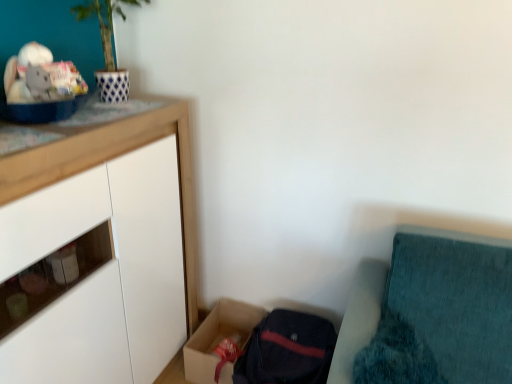
Question: Are white matte cabinet at upper left and cardboard box at lower center located far from each other?

Choices:
 (A) yes
 (B) no

Answer: (B)

Question: Does white matte cabinet at upper left have a larger size compared to cardboard box at lower center?

Choices:
 (A) yes
 (B) no

Answer: (A)

Question: Does white matte cabinet at upper left have a lesser height compared to cardboard box at lower center?

Choices:
 (A) no
 (B) yes

Answer: (A)

Question: Is cardboard box at lower center completely or partially inside white matte cabinet at upper left?

Choices:
 (A) yes
 (B) no

Answer: (B)

Question: Is white matte cabinet at upper left to the left of cardboard box at lower center from the viewer's perspective?

Choices:
 (A) yes
 (B) no

Answer: (A)

Question: Are white matte cabinet at upper left and cardboard box at lower center making contact?

Choices:
 (A) yes
 (B) no

Answer: (B)

Question: Is cardboard box at lower center located within teal fabric cushion at lower right?

Choices:
 (A) yes
 (B) no

Answer: (B)

Question: Is teal fabric cushion at lower right with cardboard box at lower center?

Choices:
 (A) yes
 (B) no

Answer: (B)

Question: From a real-world perspective, is teal fabric cushion at lower right beneath cardboard box at lower center?

Choices:
 (A) no
 (B) yes

Answer: (A)

Question: From the image's perspective, is teal fabric cushion at lower right on top of cardboard box at lower center?

Choices:
 (A) yes
 (B) no

Answer: (A)

Question: Considering the relative sizes of teal fabric cushion at lower right and cardboard box at lower center in the image provided, is teal fabric cushion at lower right wider than cardboard box at lower center?

Choices:
 (A) no
 (B) yes

Answer: (A)

Question: Is teal fabric cushion at lower right facing towards cardboard box at lower center?

Choices:
 (A) no
 (B) yes

Answer: (A)

Question: Is white matte cabinet at upper left not close to teal fabric cushion at lower right?

Choices:
 (A) no
 (B) yes

Answer: (A)